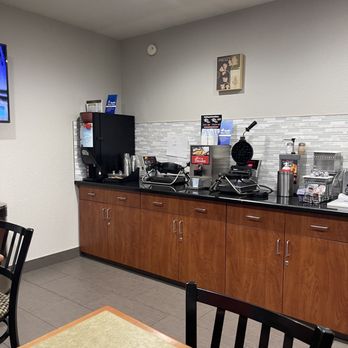
Image resolution: width=348 pixels, height=348 pixels. In order to click on wall in this screenshot , I will do `click(55, 88)`.